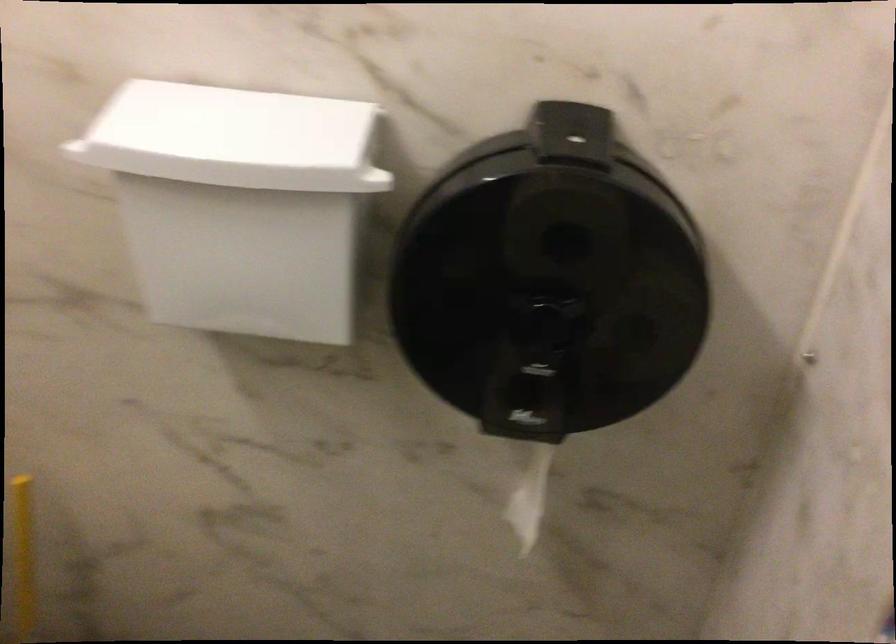
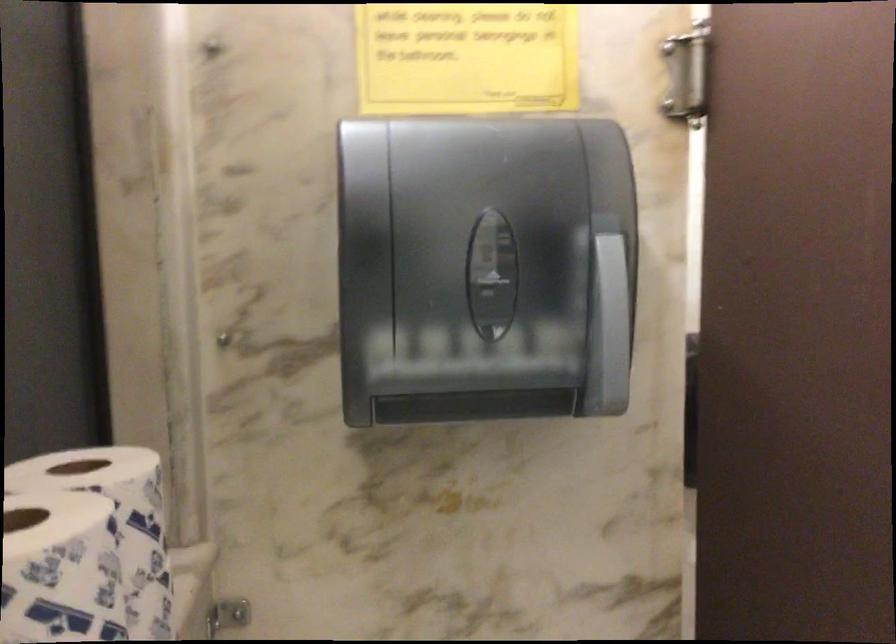
Question: I am providing you with two images of the same scene from different viewpoints. After the viewpoint changes to image2, which objects are now occluded?

Choices:
 (A) paper towel slot
 (B) roll of toilet paper
 (C) white dispenser lid
 (D) silver camera tripod

Answer: (C)